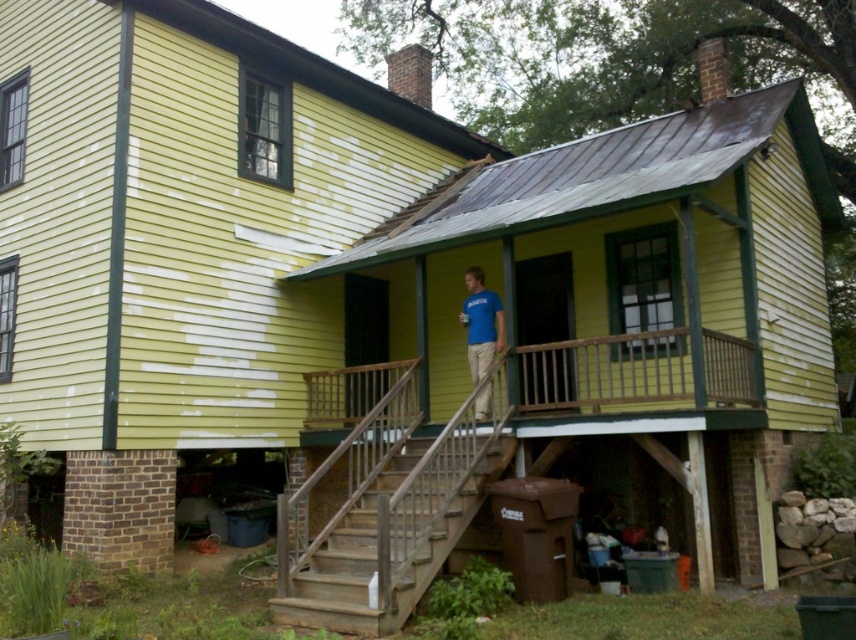
Can you confirm if wooden at center is positioned above blue t-shirt at center?

Actually, wooden at center is below blue t-shirt at center.

Between point (319, 394) and point (459, 317), which one is positioned in front?

Point (319, 394) is more forward.

What are the coordinates of `wooden at center` in the screenshot? It's located at (632, 371).

Between point (697, 385) and point (495, 460), which one is positioned in front?

Point (697, 385) is more forward.

Which of these two, wooden at center or weathered wood stairs at center, stands shorter?

wooden at center

You are a GUI agent. You are given a task and a screenshot of the screen. Output one action in this format:
    pyautogui.click(x=<x>, y=<y>)
    Task: Click on the wooden at center
    The height and width of the screenshot is (640, 856).
    Given the screenshot: What is the action you would take?
    pyautogui.click(x=632, y=371)

Describe the element at coordinates (375, 554) in the screenshot. This screenshot has width=856, height=640. I see `weathered wood stairs at center` at that location.

Which is more to the left, weathered wood stairs at center or blue t-shirt at center?

weathered wood stairs at center is more to the left.

Who is more forward, (456, 528) or (470, 369)?

Point (456, 528) is in front.

Locate an element on the screen. This screenshot has width=856, height=640. weathered wood stairs at center is located at coordinates (375, 554).